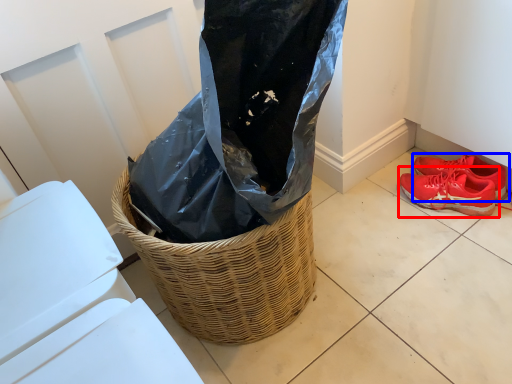
Question: Which of the following is the farthest to the observer, footwear (highlighted by a red box) or footwear (highlighted by a blue box)?

Choices:
 (A) footwear
 (B) footwear

Answer: (B)